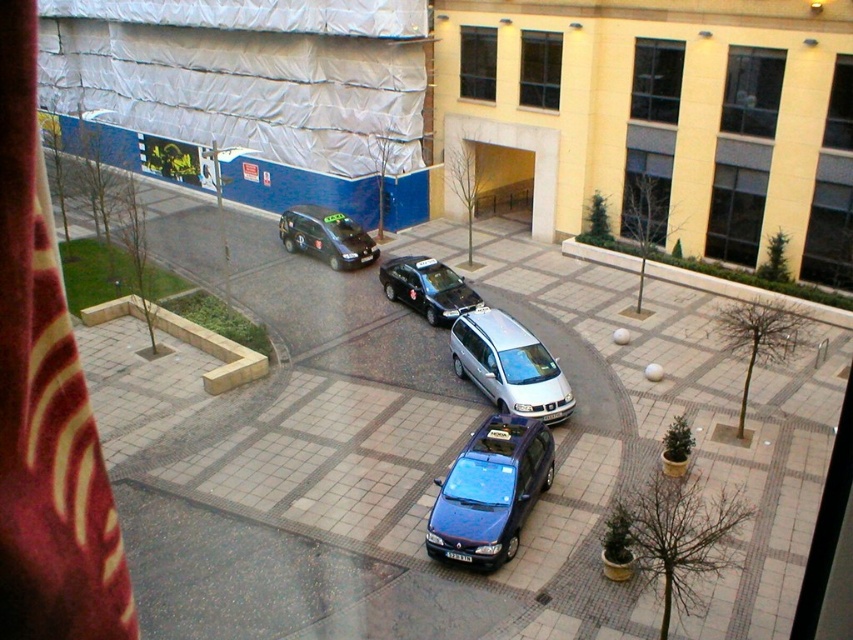
You are a delivery person trying to park your van, which is 2 meters wide, in the space between the glossy blue car at center and the black glossy taxi at center. Based on the scene, can your van fit in that space?

The glossy blue car at center has a lesser width compared to black glossy taxi at center, so the space between them may be insufficient for a 2 meter wide van. The van might not fit.

You are a pedestrian standing on the sidewalk and see the metallic silver van at center and the shiny black car at center. Which vehicle is closer to the right side of the road?

The metallic silver van at center is positioned on the right side of the shiny black car at center, so it is closer to the right side of the road.

You are standing at the center of the paved area and want to hail the black glossy taxi at center. Which direction should you walk to reach it?

The black glossy taxi at center is located at point (427, 288), so you should walk towards the center of the image to reach it.